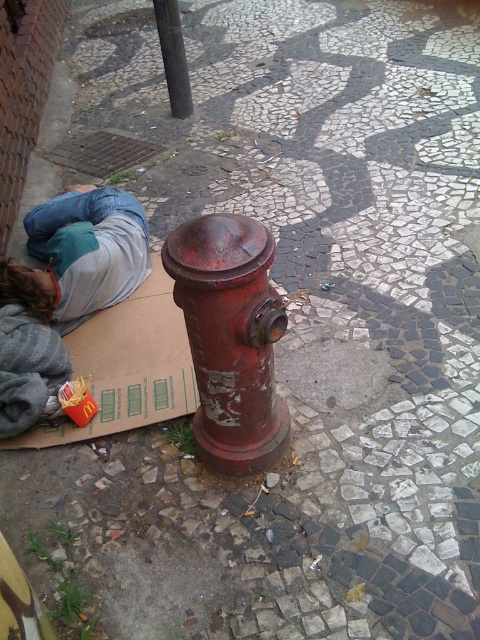
You are standing at point (180, 33) and want to walk to the red fire hydrant. Will you pass through point (192, 410) on your way there?

Yes, because point (192, 410) is in front of point (180, 33), so you will pass through it on the way to the red fire hydrant.

You are a photographer holding a camera. You want to take a picture of the rusty metal hydrant at center from a distance of 2 meters. Can you step back to achieve this?

The distance between the rusty metal hydrant at center and the camera is currently 1.64 meters. Since you want to be 2 meters away, you need to step back an additional 0.36 meters to reach the desired distance.

Based on the photo, you are standing at the center of the image and want to place a new red fire hydrant exactly where the cardboard box at lower left is located. Is this possible?

The cardboard box at lower left is at point (128, 365), so yes, you can place the new red fire hydrant there.